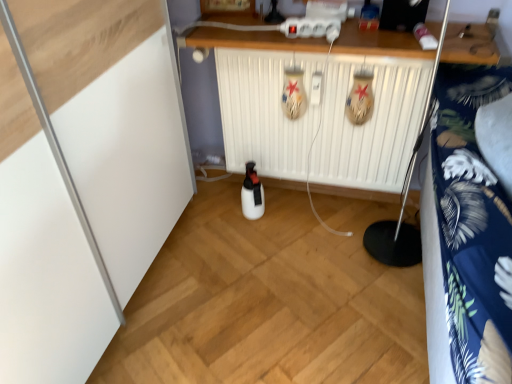
Question: Considering the relative sizes of white plastic radiator at center and blue floral fabric at right in the image provided, is white plastic radiator at center taller than blue floral fabric at right?

Choices:
 (A) yes
 (B) no

Answer: (B)

Question: From the image's perspective, is white plastic radiator at center below blue floral fabric at right?

Choices:
 (A) yes
 (B) no

Answer: (B)

Question: Is white plastic radiator at center facing away from blue floral fabric at right?

Choices:
 (A) no
 (B) yes

Answer: (A)

Question: Is white plastic radiator at center at the left side of blue floral fabric at right?

Choices:
 (A) yes
 (B) no

Answer: (A)

Question: Is white plastic radiator at center with blue floral fabric at right?

Choices:
 (A) no
 (B) yes

Answer: (A)

Question: From their relative heights in the image, would you say white plastic radiator at center is taller or shorter than blue floral fabric at right?

Choices:
 (A) short
 (B) tall

Answer: (A)

Question: Is point (248, 72) positioned closer to the camera than point (475, 334)?

Choices:
 (A) farther
 (B) closer

Answer: (A)

Question: Would you say white plastic radiator at center is to the left or to the right of blue floral fabric at right in the picture?

Choices:
 (A) left
 (B) right

Answer: (A)

Question: Would you say white plastic radiator at center is inside or outside blue floral fabric at right?

Choices:
 (A) outside
 (B) inside

Answer: (A)

Question: Which is correct: white wood counter at upper center is inside blue floral fabric at right, or outside of it?

Choices:
 (A) outside
 (B) inside

Answer: (A)

Question: In terms of size, does white wood counter at upper center appear bigger or smaller than blue floral fabric at right?

Choices:
 (A) big
 (B) small

Answer: (B)

Question: From a real-world perspective, is white wood counter at upper center above or below blue floral fabric at right?

Choices:
 (A) above
 (B) below

Answer: (A)

Question: In terms of height, does white wood counter at upper center look taller or shorter compared to blue floral fabric at right?

Choices:
 (A) short
 (B) tall

Answer: (A)

Question: From the image's perspective, is blue floral fabric at right positioned above or below white wood counter at upper center?

Choices:
 (A) above
 (B) below

Answer: (B)

Question: Is point (493, 177) closer or farther from the camera than point (253, 41)?

Choices:
 (A) closer
 (B) farther

Answer: (A)